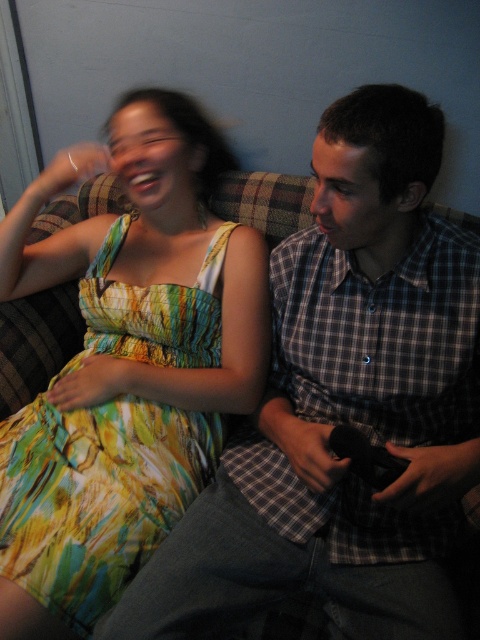
You are a photographer trying to capture a candid shot of the two people on the plaid couch. You notice two points marked in the scene. The first point is at coordinates point [287,577] and the second is at point [96,326]. To ensure the shot is framed correctly, which point should you focus on first if you want to capture the person closer to the front of the couch?

Point [287,577] is in front of point [96,326], so you should focus on point [287,577] first to capture the person closer to the front of the couch.

Based on the scene description, can you determine which object is covering the other between the plaid shirt at center and the printed fabric dress at left?

The plaid shirt at center is positioned over the printed fabric dress at left, so the plaid shirt at center is covering the printed fabric dress at left.

Consider the image. You are a delivery robot that needs to place a small package on the couch between the two people. The package requires a flat surface at least 80 centimeters away from the viewer to avoid being knocked over. Can you safely place the package at point (420,611)?

The distance of point (420,611) from the viewer is 79.24 centimeters, which is less than the required 80 centimeters. Therefore, placing the package there may risk it being knocked over.